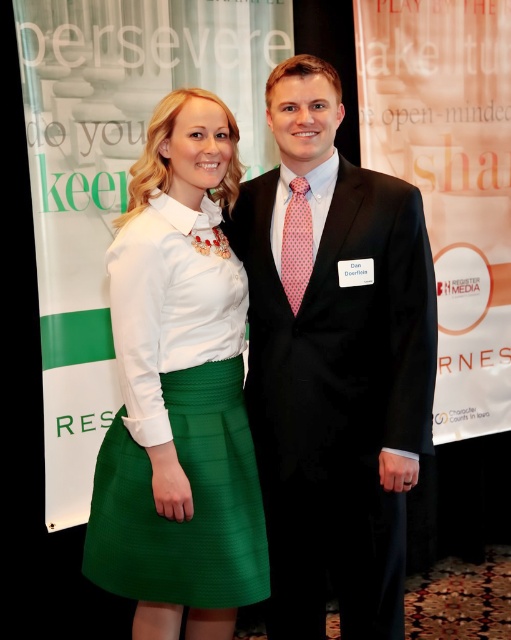
Question: Which point is closer to the camera?

Choices:
 (A) (287, 189)
 (B) (201, 464)

Answer: (B)

Question: Does matte black suit at center appear over green textured skirt at center?

Choices:
 (A) yes
 (B) no

Answer: (A)

Question: Is matte black suit at center behind green textured skirt at center?

Choices:
 (A) yes
 (B) no

Answer: (A)

Question: Can you confirm if matte black suit at center is positioned to the left of green textured skirt at center?

Choices:
 (A) yes
 (B) no

Answer: (B)